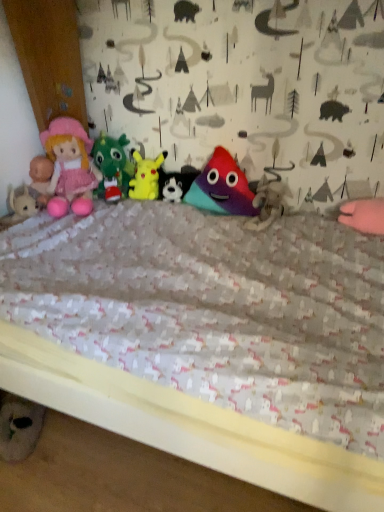
Question: Is multicolored fabric triangle at center, which is counted as the fifth toy, starting from the left, surrounded by pink plush doll at left?

Choices:
 (A) no
 (B) yes

Answer: (A)

Question: From a real-world perspective, is pink plush doll at left positioned over multicolored fabric triangle at center, which is counted as the fifth toy, starting from the left, based on gravity?

Choices:
 (A) yes
 (B) no

Answer: (A)

Question: Can you confirm if pink plush doll at left is positioned to the left of multicolored fabric triangle at center, acting as the 1th toy starting from the right?

Choices:
 (A) yes
 (B) no

Answer: (A)

Question: From the image's perspective, does pink plush doll at left appear lower than multicolored fabric triangle at center, which is counted as the fifth toy, starting from the left?

Choices:
 (A) yes
 (B) no

Answer: (B)

Question: Considering the relative positions of pink plush doll at left and multicolored fabric triangle at center, acting as the 1th toy starting from the right, in the image provided, is pink plush doll at left in front of multicolored fabric triangle at center, acting as the 1th toy starting from the right,?

Choices:
 (A) no
 (B) yes

Answer: (A)

Question: Considering the positions of pink plush doll at left and multicolored fabric triangle at center, which is counted as the fifth toy, starting from the left, in the image, is pink plush doll at left bigger or smaller than multicolored fabric triangle at center, which is counted as the fifth toy, starting from the left,?

Choices:
 (A) big
 (B) small

Answer: (A)

Question: From their relative heights in the image, would you say pink plush doll at left is taller or shorter than multicolored fabric triangle at center, acting as the 1th toy starting from the right?

Choices:
 (A) tall
 (B) short

Answer: (A)

Question: From the image's perspective, relative to multicolored fabric triangle at center, which is counted as the fifth toy, starting from the left, is pink plush doll at left above or below?

Choices:
 (A) above
 (B) below

Answer: (A)

Question: Visually, is pink plush doll at left positioned to the left or to the right of multicolored fabric triangle at center, which is counted as the fifth toy, starting from the left?

Choices:
 (A) left
 (B) right

Answer: (A)

Question: From the image's perspective, is matte plastic pyramid at center, marked as the 3th toy in a left-to-right arrangement, positioned above or below multicolored fabric triangle at center, which is counted as the fifth toy, starting from the left?

Choices:
 (A) below
 (B) above

Answer: (B)

Question: Choose the correct answer: Is matte plastic pyramid at center, arranged as the 3th toy when viewed from the right, inside multicolored fabric triangle at center, acting as the 1th toy starting from the right, or outside it?

Choices:
 (A) outside
 (B) inside

Answer: (A)

Question: Is matte plastic pyramid at center, arranged as the 3th toy when viewed from the right, bigger or smaller than multicolored fabric triangle at center, acting as the 1th toy starting from the right?

Choices:
 (A) small
 (B) big

Answer: (A)

Question: Based on their positions, is matte plastic pyramid at center, marked as the 3th toy in a left-to-right arrangement, located to the left or right of multicolored fabric triangle at center, which is counted as the fifth toy, starting from the left?

Choices:
 (A) right
 (B) left

Answer: (B)

Question: Which is correct: multicolored plush triangle at center, which appears as the 4th toy when viewed from the left, is inside multicolored fabric triangle at center, which is counted as the fifth toy, starting from the left, or outside of it?

Choices:
 (A) inside
 (B) outside

Answer: (B)

Question: Visually, is multicolored plush triangle at center, which appears as the 4th toy when viewed from the left, positioned to the left or to the right of multicolored fabric triangle at center, which is counted as the fifth toy, starting from the left?

Choices:
 (A) left
 (B) right

Answer: (A)